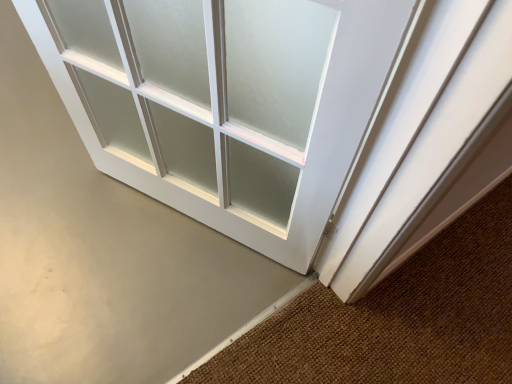
Based on the photo, what is the approximate height of white frosted glass door at center?

It is 2.21 inches.

This screenshot has width=512, height=384. What are the coordinates of `white frosted glass door at center` in the screenshot? It's located at (224, 102).

What do you see at coordinates (224, 102) in the screenshot? I see `white frosted glass door at center` at bounding box center [224, 102].

The width and height of the screenshot is (512, 384). What are the coordinates of `brown textured doormat at lower right` in the screenshot? It's located at (396, 318).

In order to face brown textured doormat at lower right, should I rotate leftwards or rightwards?

A 22.923 degree turn to the right will do.

The image size is (512, 384). What do you see at coordinates (396, 318) in the screenshot?
I see `brown textured doormat at lower right` at bounding box center [396, 318].

Where is `white frosted glass door at center`? This screenshot has width=512, height=384. white frosted glass door at center is located at coordinates (224, 102).

Is brown textured doormat at lower right to the left of white frosted glass door at center from the viewer's perspective?

No.

Based on the photo, which object is further away from the camera taking this photo, brown textured doormat at lower right or white frosted glass door at center?

white frosted glass door at center is more distant.

Is point (376, 363) behind point (178, 78)?

Yes, it is.

From the image's perspective, between brown textured doormat at lower right and white frosted glass door at center, who is located below?

brown textured doormat at lower right is shown below in the image.

From a real-world perspective, is brown textured doormat at lower right on top of white frosted glass door at center?

Indeed, from a real-world perspective, brown textured doormat at lower right stands above white frosted glass door at center.

Is brown textured doormat at lower right wider than white frosted glass door at center?

No, brown textured doormat at lower right is not wider than white frosted glass door at center.

Is brown textured doormat at lower right taller or shorter than white frosted glass door at center?

Considering their sizes, brown textured doormat at lower right has less height than white frosted glass door at center.

Who is bigger, brown textured doormat at lower right or white frosted glass door at center?

With larger size is white frosted glass door at center.

Can we say brown textured doormat at lower right lies outside white frosted glass door at center?

Yes, brown textured doormat at lower right is not within white frosted glass door at center.

Are brown textured doormat at lower right and white frosted glass door at center beside each other?

brown textured doormat at lower right is not next to white frosted glass door at center, and they're not touching.

Is brown textured doormat at lower right oriented away from white frosted glass door at center?

No, white frosted glass door at center is not at the back of brown textured doormat at lower right.

I want to click on door below the brown textured doormat at lower right (from a real-world perspective), so click(x=224, y=102).

Which object is positioned more to the left, white frosted glass door at center or brown textured doormat at lower right?

white frosted glass door at center is more to the left.

Does white frosted glass door at center lie behind brown textured doormat at lower right?

Yes, the depth of white frosted glass door at center is greater than that of brown textured doormat at lower right.

Is point (53, 60) closer to viewer compared to point (328, 359)?

Yes, point (53, 60) is in front of point (328, 359).

From the image's perspective, is white frosted glass door at center above or below brown textured doormat at lower right?

white frosted glass door at center is above brown textured doormat at lower right.

From a real-world perspective, is white frosted glass door at center below brown textured doormat at lower right?

Correct, in the physical world, white frosted glass door at center is lower than brown textured doormat at lower right.

Looking at their sizes, would you say white frosted glass door at center is wider or thinner than brown textured doormat at lower right?

In the image, white frosted glass door at center appears to be wider than brown textured doormat at lower right.

Between white frosted glass door at center and brown textured doormat at lower right, which one has more height?

white frosted glass door at center is taller.

Is white frosted glass door at center smaller than brown textured doormat at lower right?

Incorrect, white frosted glass door at center is not smaller in size than brown textured doormat at lower right.

Is white frosted glass door at center spatially inside brown textured doormat at lower right, or outside of it?

white frosted glass door at center lies outside brown textured doormat at lower right.

Is white frosted glass door at center positioned far away from brown textured doormat at lower right?

No.

Is white frosted glass door at center turned away from brown textured doormat at lower right?

white frosted glass door at center is not turned away from brown textured doormat at lower right.

Find the location of a particular element. The height and width of the screenshot is (384, 512). doormat that appears on the right of white frosted glass door at center is located at coordinates click(396, 318).

Where is `doormat in front of the white frosted glass door at center`? The height and width of the screenshot is (384, 512). doormat in front of the white frosted glass door at center is located at coordinates (396, 318).

This screenshot has height=384, width=512. I want to click on door located underneath the brown textured doormat at lower right (from a real-world perspective), so click(x=224, y=102).